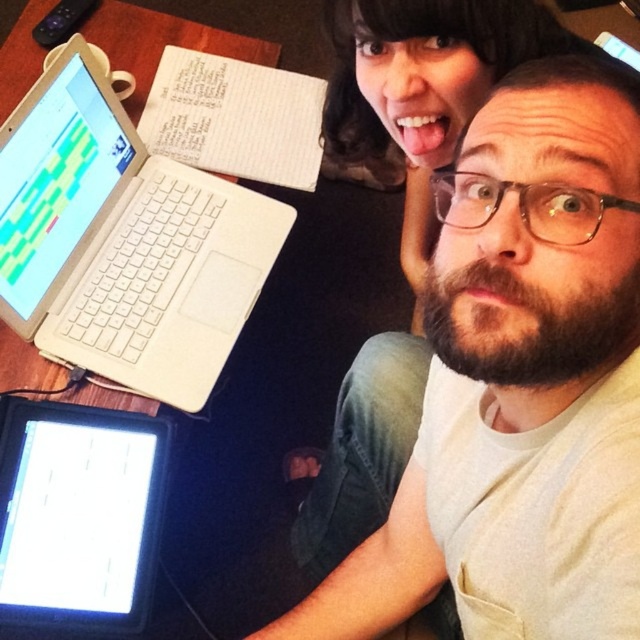
You are organizing a meeting and need to place a 12 inch by 12 inch presentation board on either the wooden table at upper left or the black glossy tablet at lower left. Based on their sizes, which surface can accommodate the board without overlapping?

The wooden table at upper left has a larger size compared to the black glossy tablet at lower left, so the presentation board can be placed on the wooden table at upper left without overlapping.

You are standing 5 feet away from the desk. Can you reach the point at coordinates point (244, 602) on the desk without moving closer?

The point (244, 602) is 5.08 feet away from the viewer, so you are exactly at the required distance. Since you are already 5 feet away, you can just barely reach it without moving closer.

You are a delivery robot with a package that measures 10 inches in length. You need to place it on the wooden table at upper left and white plastic laptop at upper left. Can you fit the package between them?

The distance between the wooden table at upper left and white plastic laptop at upper left is 8.62 inches, so the package measuring 10 inches is too long to fit between them.